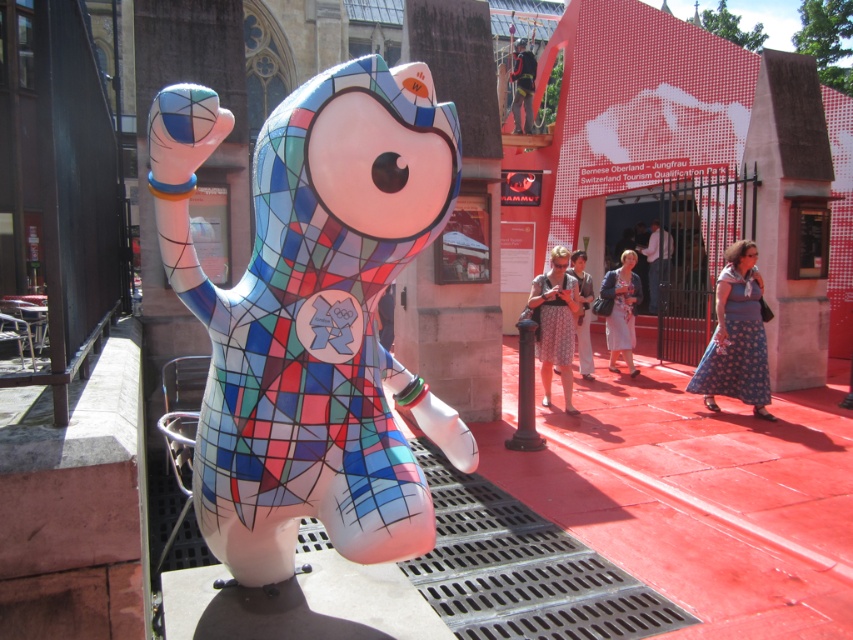
Question: Where is geometric mosaic statue at center located in relation to blue dotted dress at center in the image?

Choices:
 (A) above
 (B) below

Answer: (B)

Question: Is blue dotted dress at center smaller than matte blue dress at center?

Choices:
 (A) no
 (B) yes

Answer: (B)

Question: Which object is farther from the camera taking this photo?

Choices:
 (A) blue floral dress at center
 (B) blue dotted dress at center
 (C) patterned fabric dress at center

Answer: (A)

Question: Which object appears closest to the camera in this image?

Choices:
 (A) blue floral dress at center
 (B) patterned fabric dress at center
 (C) dark blue fabric pants at center
 (D) geometric mosaic statue at center

Answer: (D)

Question: Where is geometric mosaic statue at center located in relation to patterned fabric dress at center in the image?

Choices:
 (A) right
 (B) left

Answer: (B)

Question: Estimate the real-world distances between objects in this image. Which object is farther from the blue dotted dress at center?

Choices:
 (A) geometric mosaic statue at center
 (B) dark blue fabric pants at center
 (C) blue fabric dress at center
 (D) patterned fabric dress at center

Answer: (B)